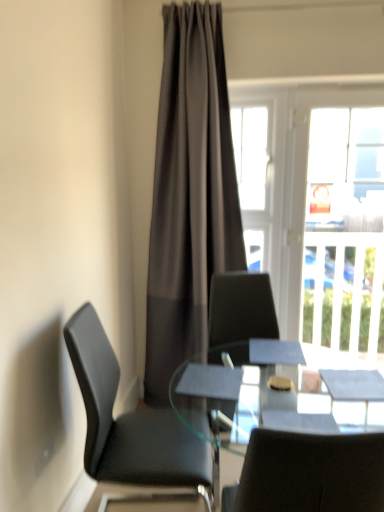
Question: Is black leather chair at left wider or thinner than transparent glass table at center?

Choices:
 (A) wide
 (B) thin

Answer: (B)

Question: Based on their sizes in the image, would you say black leather chair at left is bigger or smaller than transparent glass table at center?

Choices:
 (A) small
 (B) big

Answer: (A)

Question: Estimate the real-world distances between objects in this image. Which object is farther from the clear glass window at upper right?

Choices:
 (A) transparent glass table at center
 (B) black leather chair at left
 (C) dark gray sheer curtain at center

Answer: (A)

Question: Estimate the real-world distances between objects in this image. Which object is closer to the dark gray sheer curtain at center?

Choices:
 (A) transparent glass table at center
 (B) clear glass window at upper right
 (C) black leather chair at left

Answer: (B)